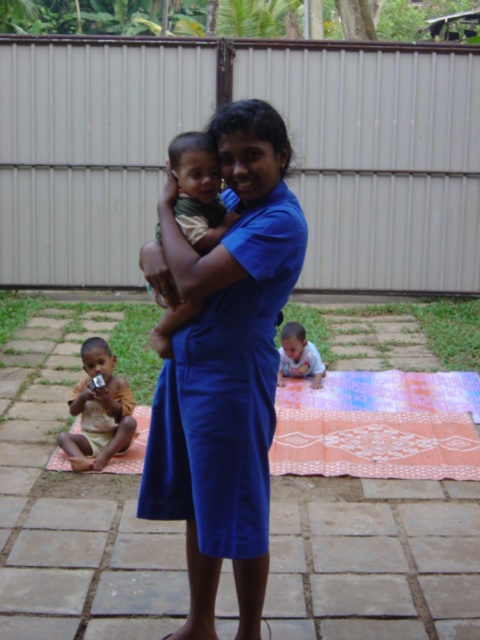
Question: Is blue fabric dress at center thinner than matte green shirt at center?

Choices:
 (A) no
 (B) yes

Answer: (A)

Question: Based on their relative distances, which object is farther from the matte green shirt at center?

Choices:
 (A) soft beige skin at center
 (B) brown cotton cloth at lower left

Answer: (A)

Question: Is blue fabric dress at center to the right of brown cotton cloth at lower left from the viewer's perspective?

Choices:
 (A) yes
 (B) no

Answer: (A)

Question: Can you confirm if blue fabric dress at center is positioned below brown cotton cloth at lower left?

Choices:
 (A) no
 (B) yes

Answer: (A)

Question: Estimate the real-world distances between objects in this image. Which object is closer to the blue fabric dress at center?

Choices:
 (A) matte green shirt at center
 (B) soft beige skin at center
 (C) brown cotton cloth at lower left

Answer: (A)

Question: Which object is closer to the camera taking this photo?

Choices:
 (A) matte green shirt at center
 (B) blue fabric dress at center

Answer: (B)